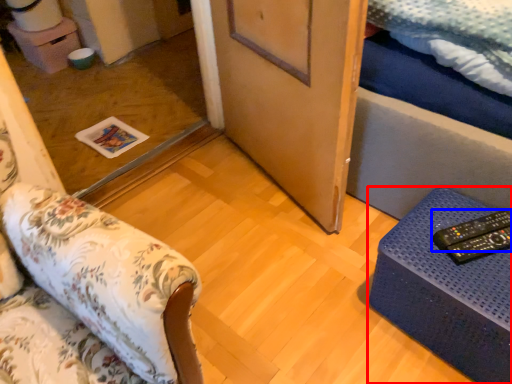
Question: Among these objects, which one is nearest to the camera, furniture (highlighted by a red box) or remote (highlighted by a blue box)?

Choices:
 (A) furniture
 (B) remote

Answer: (A)